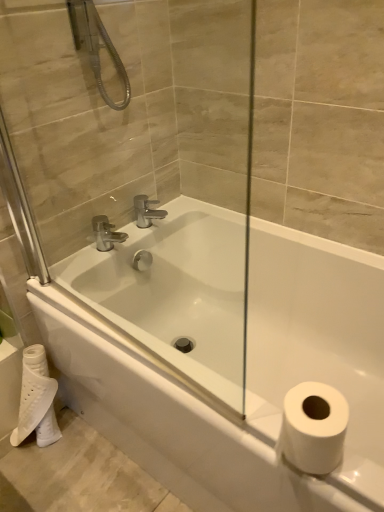
Question: From the image's perspective, is polished chrome faucet at upper center under transparent glass door at center?

Choices:
 (A) no
 (B) yes

Answer: (B)

Question: Is polished chrome faucet at upper center not within transparent glass door at center?

Choices:
 (A) yes
 (B) no

Answer: (A)

Question: Is polished chrome faucet at upper center with transparent glass door at center?

Choices:
 (A) no
 (B) yes

Answer: (A)

Question: Considering the relative sizes of polished chrome faucet at upper center and transparent glass door at center in the image provided, is polished chrome faucet at upper center smaller than transparent glass door at center?

Choices:
 (A) yes
 (B) no

Answer: (A)

Question: Does polished chrome faucet at upper center lie behind transparent glass door at center?

Choices:
 (A) no
 (B) yes

Answer: (B)

Question: Would you say polished chrome faucet at upper center is inside or outside white matte toilet paper at lower left?

Choices:
 (A) inside
 (B) outside

Answer: (B)

Question: Does point (105, 237) appear closer or farther from the camera than point (46, 433)?

Choices:
 (A) closer
 (B) farther

Answer: (A)

Question: From the image's perspective, is polished chrome faucet at upper center located above or below white matte toilet paper at lower left?

Choices:
 (A) above
 (B) below

Answer: (A)

Question: In terms of height, does polished chrome faucet at upper center look taller or shorter compared to white matte toilet paper at lower left?

Choices:
 (A) tall
 (B) short

Answer: (B)

Question: In terms of width, does transparent glass door at center look wider or thinner when compared to polished chrome faucet at upper center?

Choices:
 (A) wide
 (B) thin

Answer: (B)

Question: Looking at the image, does transparent glass door at center seem bigger or smaller compared to polished chrome faucet at upper center?

Choices:
 (A) small
 (B) big

Answer: (B)

Question: From a real-world perspective, is transparent glass door at center above or below polished chrome faucet at upper center?

Choices:
 (A) above
 (B) below

Answer: (A)

Question: Considering their positions, is transparent glass door at center located in front of or behind polished chrome faucet at upper center?

Choices:
 (A) front
 (B) behind

Answer: (A)

Question: Is white glossy bathtub at center inside the boundaries of transparent glass door at center, or outside?

Choices:
 (A) outside
 (B) inside

Answer: (A)

Question: Considering their positions, is white glossy bathtub at center located in front of or behind transparent glass door at center?

Choices:
 (A) behind
 (B) front

Answer: (A)